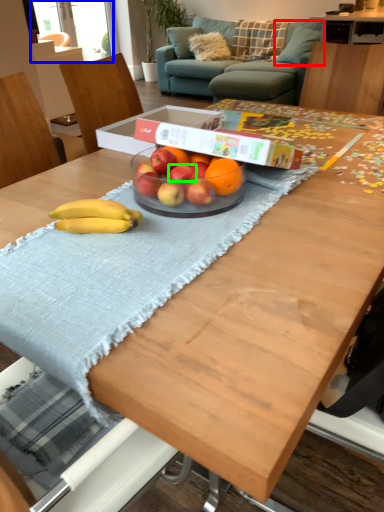
Question: Which object is the closest to the pillow (highlighted by a red box)? Choose among these: window screen (highlighted by a blue box) or apple (highlighted by a green box).

Choices:
 (A) window screen
 (B) apple

Answer: (A)